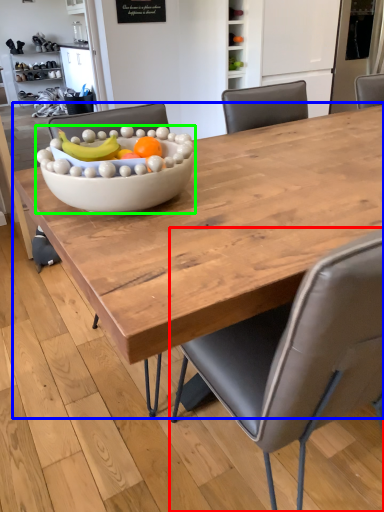
Question: Which object is the closest to the chair (highlighted by a red box)? Choose among these: coffee table (highlighted by a blue box) or bowl (highlighted by a green box).

Choices:
 (A) coffee table
 (B) bowl

Answer: (A)